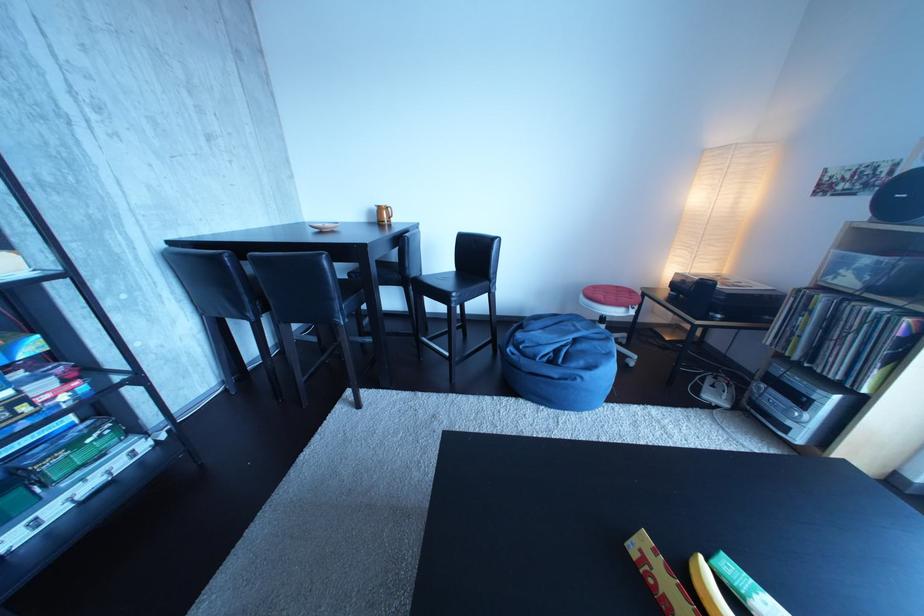
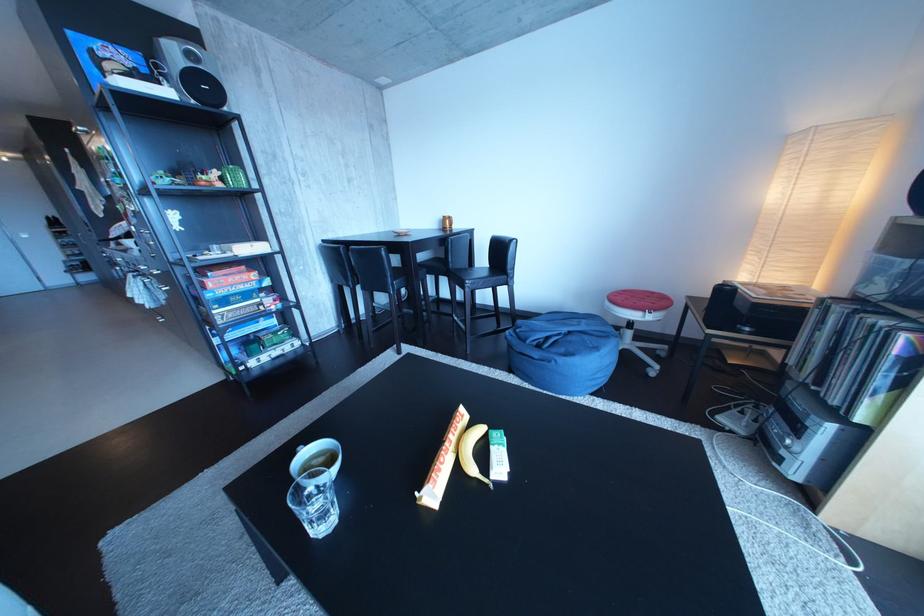
Where in the second image is the point corresponding to pixel 630 293 from the first image?

(666, 299)